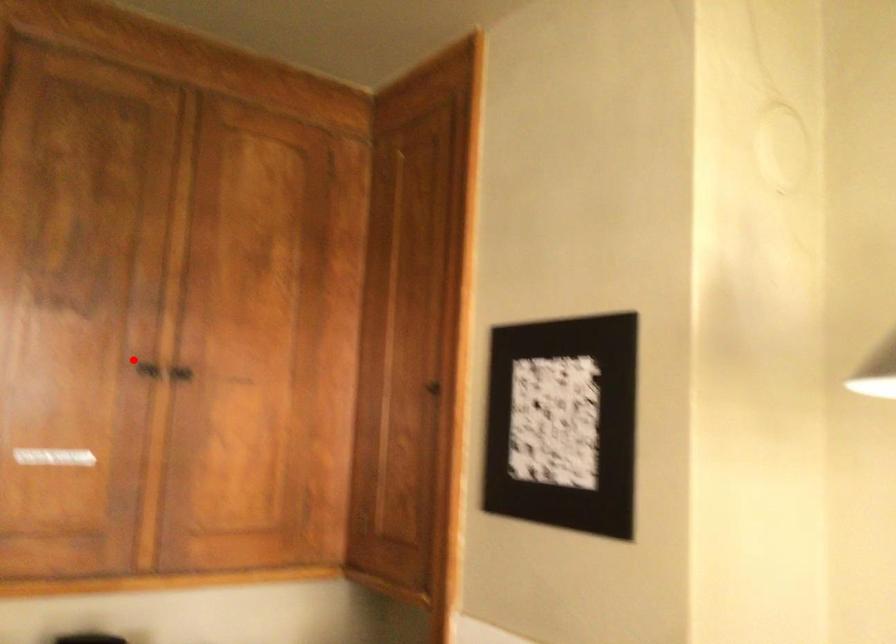
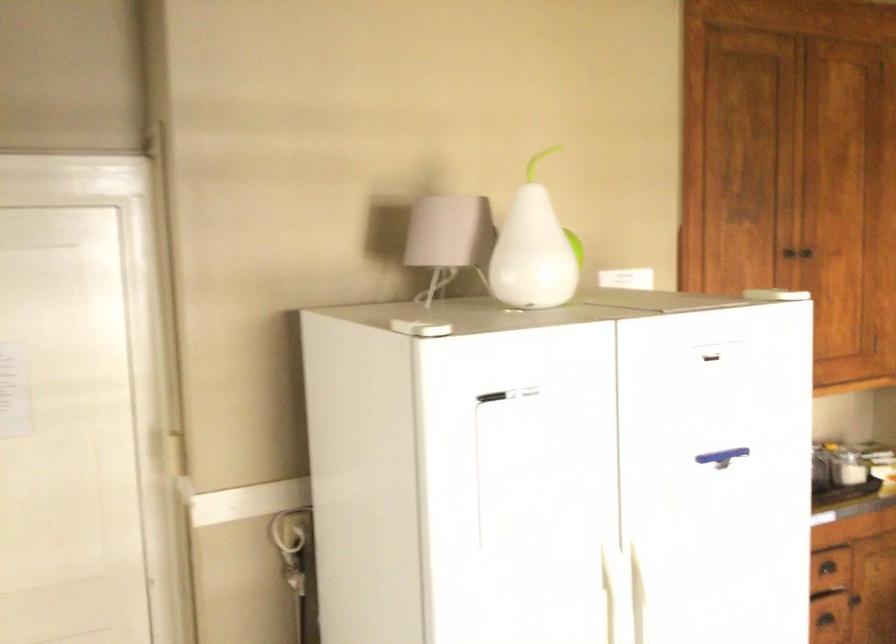
Find the pixel in the second image that matches the highlighted location in the first image.

(786, 257)